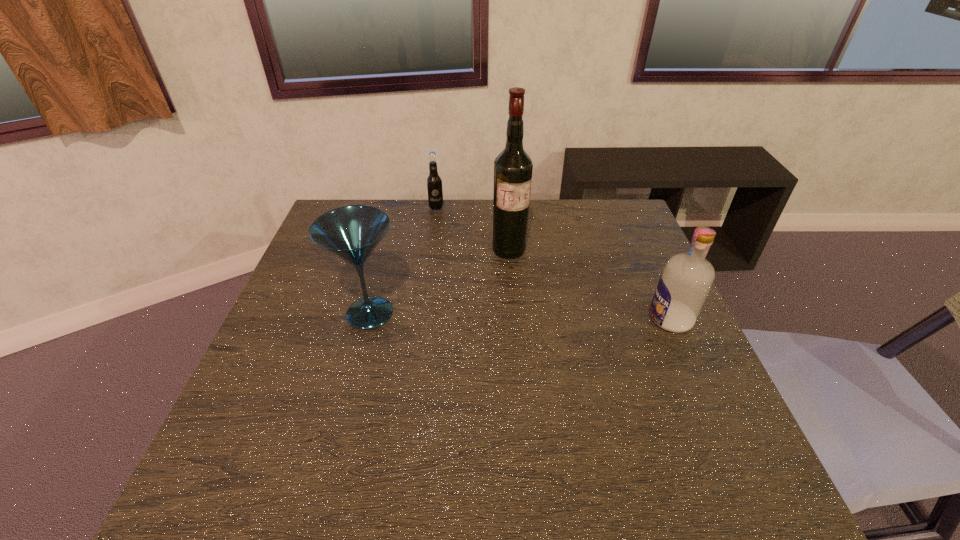
Where is `free space located on the front and back of the wine bottle`? The width and height of the screenshot is (960, 540). free space located on the front and back of the wine bottle is located at coordinates (526, 290).

You are a GUI agent. You are given a task and a screenshot of the screen. Output one action in this format:
    pyautogui.click(x=<x>, y=<y>)
    Task: Click on the vacant space located 0.240m on the front and back of the wine bottle
    This screenshot has height=540, width=960.
    Given the screenshot: What is the action you would take?
    pyautogui.click(x=540, y=320)

Identify the location of blank area located 0.170m on the front and back of the wine bottle. The height and width of the screenshot is (540, 960). (531, 300).

The height and width of the screenshot is (540, 960). I want to click on blank area located on the label of the third object from right to left, so click(444, 225).

Where is `free region located on the label of the third object from right to left`? free region located on the label of the third object from right to left is located at coordinates (467, 284).

The width and height of the screenshot is (960, 540). I want to click on vacant point located 0.170m on the label of the third object from right to left, so click(x=449, y=241).

Image resolution: width=960 pixels, height=540 pixels. Find the location of `wine bottle positioned at the far edge`. wine bottle positioned at the far edge is located at coordinates 513,167.

Locate an element on the screen. root beer present at the far edge is located at coordinates (434, 182).

Locate an element on the screen. This screenshot has height=540, width=960. object located in the left edge section of the desktop is located at coordinates (351, 233).

This screenshot has width=960, height=540. What are the coordinates of `object positioned at the right edge` in the screenshot? It's located at (686, 280).